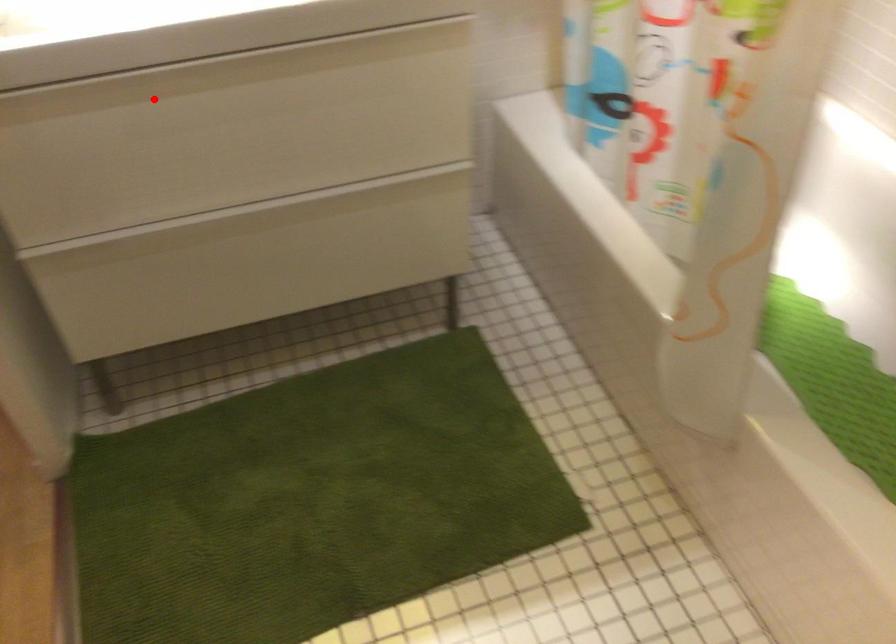
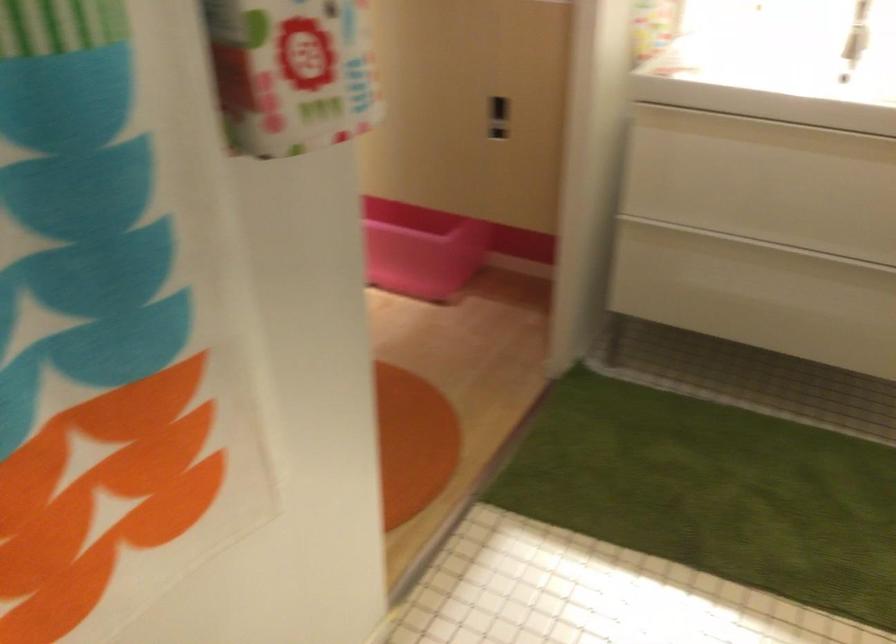
Question: I am providing you with two images of the same scene from different viewpoints. A red point is shown in image1. For the corresponding object point in image2, is it positioned nearer or farther from the camera?

Choices:
 (A) Nearer
 (B) Farther

Answer: (B)